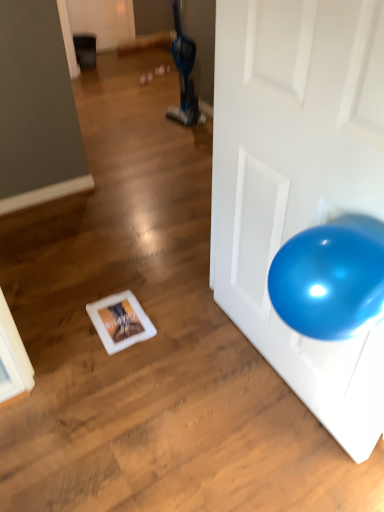
At what (x,y) coordinates should I click in order to perform the action: click on free space below glossy white door at right (from a real-world perspective). Please return your answer as a coordinate pair (x, y). The height and width of the screenshot is (512, 384). Looking at the image, I should click on (273, 376).